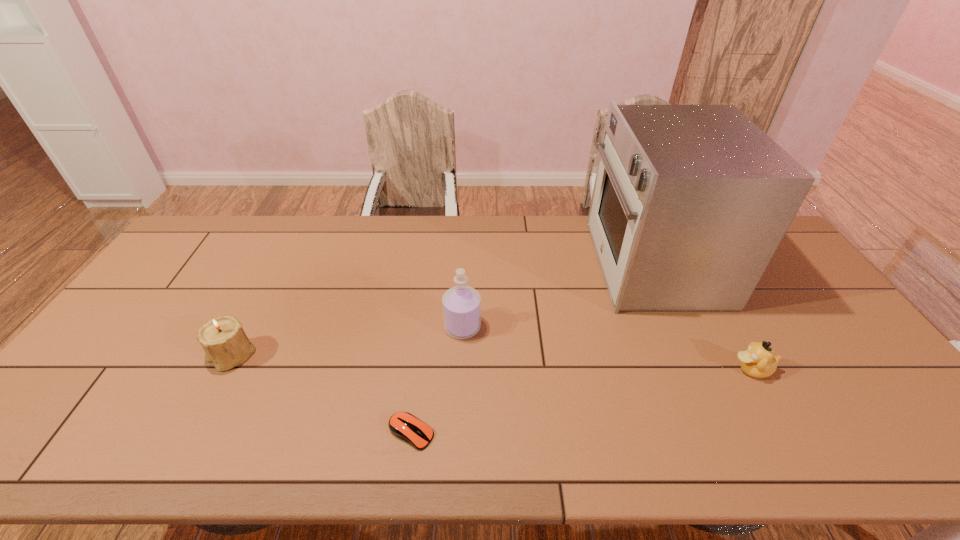
Identify the location of vacant space in between the candle_holder and the shortest object. The width and height of the screenshot is (960, 540). (322, 394).

Find the location of a particular element. The image size is (960, 540). free point between the fourth tallest object and the toaster oven is located at coordinates (702, 316).

Select which object is the closest to the second object from left to right. Please provide its 2D coordinates. Your answer should be formatted as a tuple, i.e. [(x, y)], where the tuple contains the x and y coordinates of a point satisfying the conditions above.

[(461, 304)]

Locate which object ranks second in proximity to the leftmost object. Please provide its 2D coordinates. Your answer should be formatted as a tuple, i.e. [(x, y)], where the tuple contains the x and y coordinates of a point satisfying the conditions above.

[(461, 304)]

Locate an element on the screen. vacant area in the image that satisfies the following two spatial constraints: 1. on the back side of the third object from left to right; 2. on the right side of the leftmost object is located at coordinates click(246, 327).

At what (x,y) coordinates should I click in order to perform the action: click on free location that satisfies the following two spatial constraints: 1. on the front panel of the tallest object; 2. on the front side of the nearest object. Please return your answer as a coordinate pair (x, y). This screenshot has height=540, width=960. Looking at the image, I should click on (728, 433).

Where is `vacant space that satisfies the following two spatial constraints: 1. on the front panel of the tallest object; 2. on the front side of the third tallest object`? The width and height of the screenshot is (960, 540). vacant space that satisfies the following two spatial constraints: 1. on the front panel of the tallest object; 2. on the front side of the third tallest object is located at coordinates (693, 355).